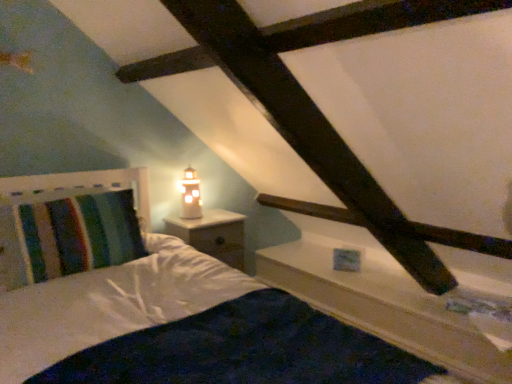
I want to click on vacant space situated above white wood ledge at upper right (from a real-world perspective), so click(406, 289).